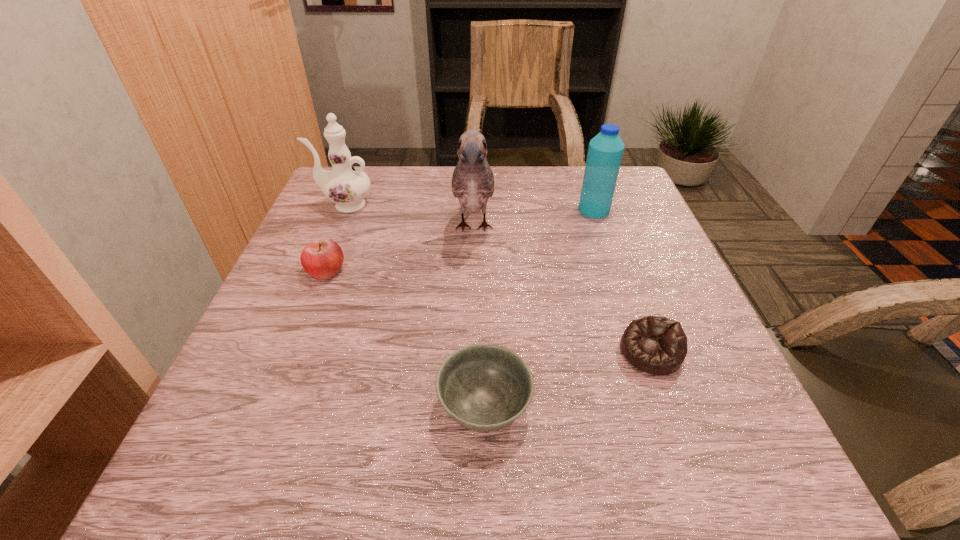
Where is `vacant space in between the parrot and the chinaware`? This screenshot has width=960, height=540. vacant space in between the parrot and the chinaware is located at coordinates (409, 217).

You are a GUI agent. You are given a task and a screenshot of the screen. Output one action in this format:
    pyautogui.click(x=<x>, y=<y>)
    Task: Click on the vacant point located between the parrot and the beanbag
    
    Given the screenshot: What is the action you would take?
    pyautogui.click(x=562, y=290)

At what (x,y) coordinates should I click in order to perform the action: click on vacant point located between the apple and the chinaware. Please return your answer as a coordinate pair (x, y). Image resolution: width=960 pixels, height=540 pixels. Looking at the image, I should click on (335, 238).

Identify the location of unoccupied area between the water bottle and the beanbag. (622, 281).

Image resolution: width=960 pixels, height=540 pixels. In order to click on free space between the water bottle and the apple in this screenshot , I will do `click(460, 240)`.

Where is `unoccupied position between the bowl and the apple`? unoccupied position between the bowl and the apple is located at coordinates (405, 339).

Where is `empty space that is in between the chinaware and the beanbag`? The image size is (960, 540). empty space that is in between the chinaware and the beanbag is located at coordinates (497, 278).

Identify which object is the second nearest to the beanbag. Please provide its 2D coordinates. Your answer should be formatted as a tuple, i.e. [(x, y)], where the tuple contains the x and y coordinates of a point satisfying the conditions above.

[(473, 181)]

Find the location of a particular element. The image size is (960, 540). object that ranks as the fourth closest to the bowl is located at coordinates (605, 151).

Locate an element on the screen. vacant space that satisfies the following two spatial constraints: 1. on the front side of the apple; 2. on the left side of the beanbag is located at coordinates (294, 352).